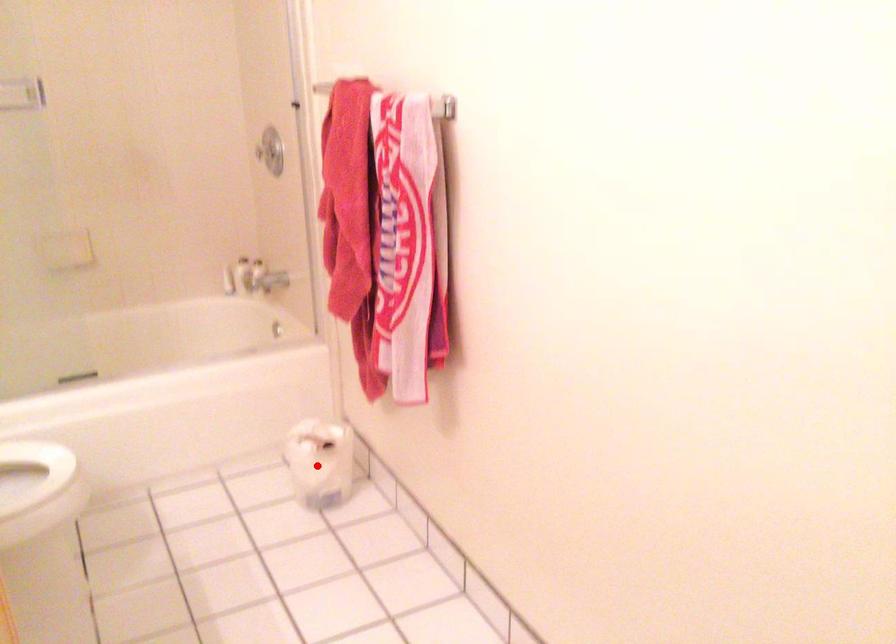
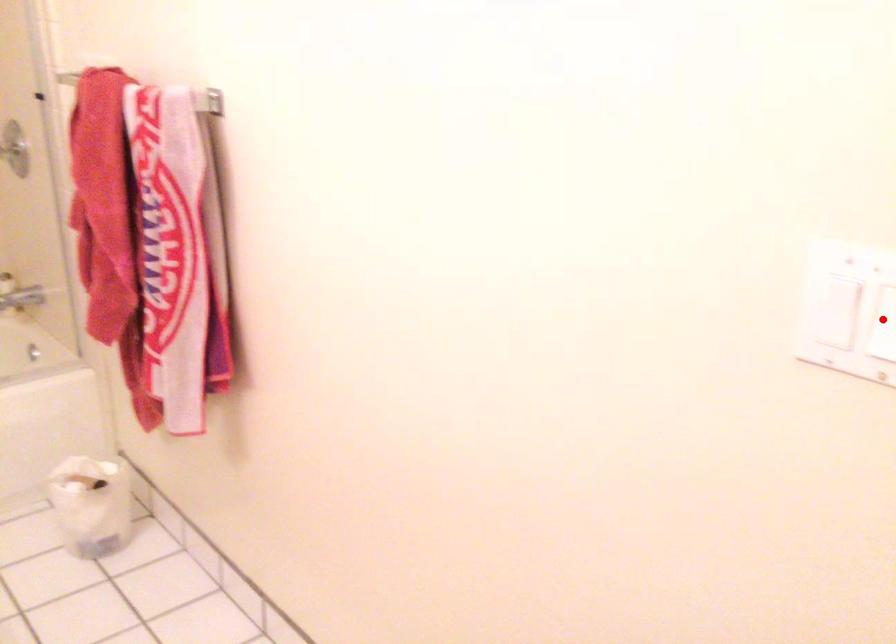
I am providing you with two images of the same scene from different viewpoints. A red point is marked on the first image and another point is marked on the second image. Is the marked point in image1 the same physical position as the marked point in image2?

No